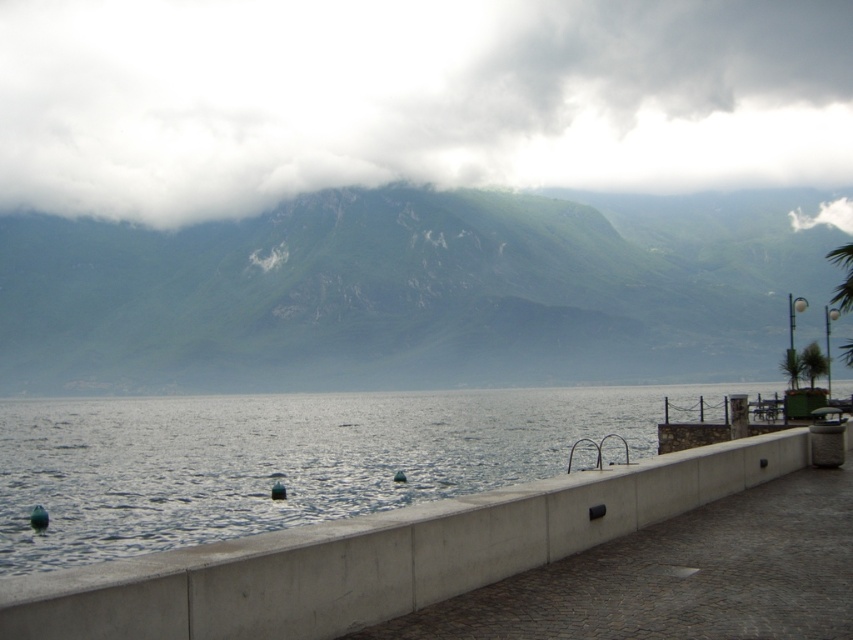
Does concrete at center have a greater width compared to green leafy palm tree at right?

No.

Is concrete at center to the right of green leafy palm tree at right from the viewer's perspective?

In fact, concrete at center is to the left of green leafy palm tree at right.

You are a GUI agent. You are given a task and a screenshot of the screen. Output one action in this format:
    pyautogui.click(x=<x>, y=<y>)
    Task: Click on the concrete at center
    
    Given the screenshot: What is the action you would take?
    tap(380, 554)

Where is `concrete at center`? concrete at center is located at coordinates (380, 554).

Does white fluffy cloud at upper center have a lesser width compared to green rocky mountain at upper center?

No.

Is point (78, 68) closer to viewer compared to point (763, 257)?

No, it is not.

Find the location of a particular element. This screenshot has width=853, height=640. white fluffy cloud at upper center is located at coordinates (410, 99).

Can you confirm if white fluffy cloud at upper center is positioned below green leafy palm tree at right?

Incorrect, white fluffy cloud at upper center is not positioned below green leafy palm tree at right.

Between point (59, 100) and point (804, 369), which one is positioned behind?

The point (59, 100) is behind.

This screenshot has width=853, height=640. I want to click on white fluffy cloud at upper center, so click(x=410, y=99).